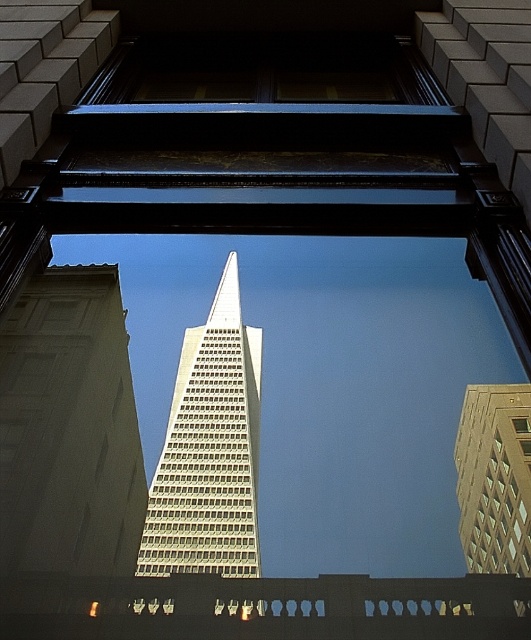
Can you confirm if white glass skyscraper at center is shorter than gold glass building at center?

In fact, white glass skyscraper at center may be taller than gold glass building at center.

Is white glass skyscraper at center wider than gold glass building at center?

Indeed, white glass skyscraper at center has a greater width compared to gold glass building at center.

What do you see at coordinates (209, 449) in the screenshot? The width and height of the screenshot is (531, 640). I see `white glass skyscraper at center` at bounding box center [209, 449].

This screenshot has width=531, height=640. Identify the location of white glass skyscraper at center. pyautogui.click(x=209, y=449).